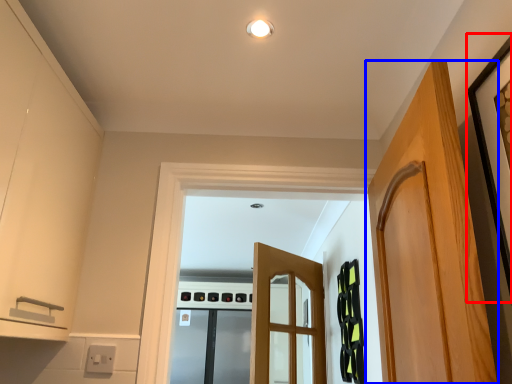
Question: Which object appears farthest to the camera in this image, picture frame (highlighted by a red box) or door (highlighted by a blue box)?

Choices:
 (A) picture frame
 (B) door

Answer: (B)